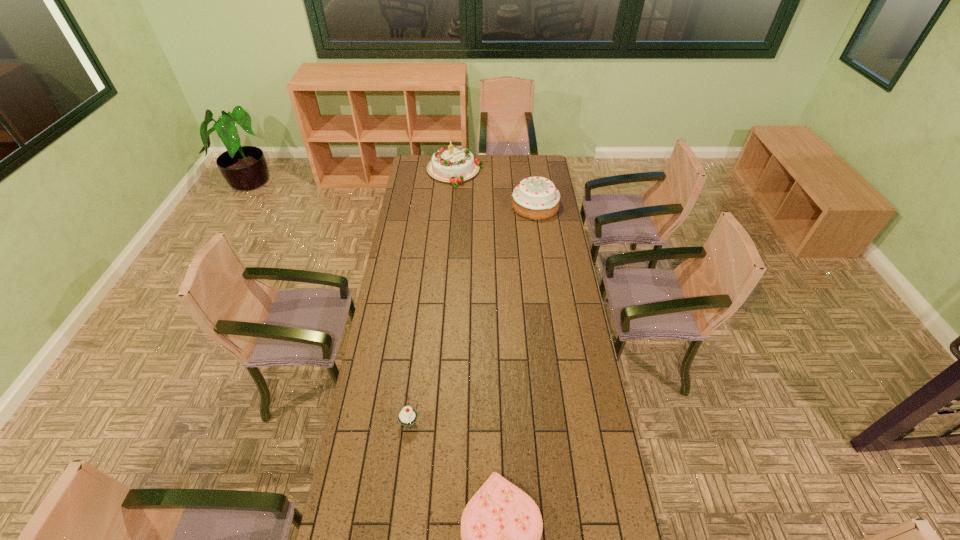
Locate an element on the screen. The width and height of the screenshot is (960, 540). the farthest object is located at coordinates (455, 164).

Where is `the second farthest object`? The width and height of the screenshot is (960, 540). the second farthest object is located at coordinates (536, 198).

I want to click on the second shortest object, so click(407, 416).

The image size is (960, 540). Identify the location of the second nearest object. (407, 416).

At what (x,y) coordinates should I click in order to perform the action: click on free region located on the front of the farthest object. Please return your answer as a coordinate pair (x, y). Looking at the image, I should click on (452, 210).

Where is `vacant space located on the front of the second nearest cake`? This screenshot has width=960, height=540. vacant space located on the front of the second nearest cake is located at coordinates (541, 252).

This screenshot has width=960, height=540. Identify the location of vacant area situated 0.350m on the right of the second shortest object. (516, 422).

In order to click on object present at the far edge in this screenshot , I will do `click(455, 164)`.

I want to click on cake at the left edge, so click(455, 164).

Locate an element on the screen. This screenshot has width=960, height=540. cupcake present at the left edge is located at coordinates pos(407,416).